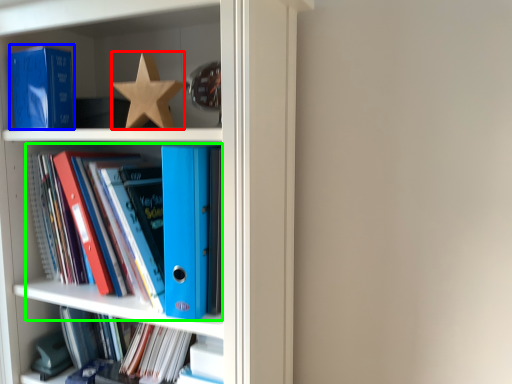
Question: Estimate the real-world distances between objects in this image. Which object is closer to star (highlighted by a red box), paperback book (highlighted by a blue box) or book (highlighted by a green box)?

Choices:
 (A) paperback book
 (B) book

Answer: (A)